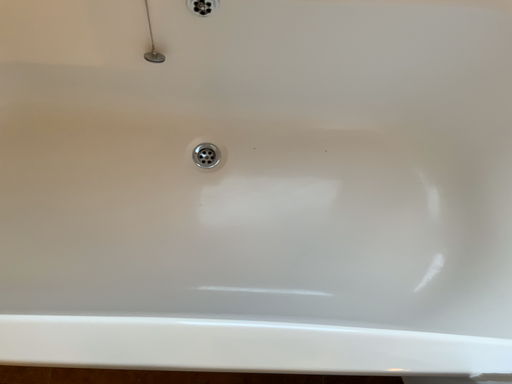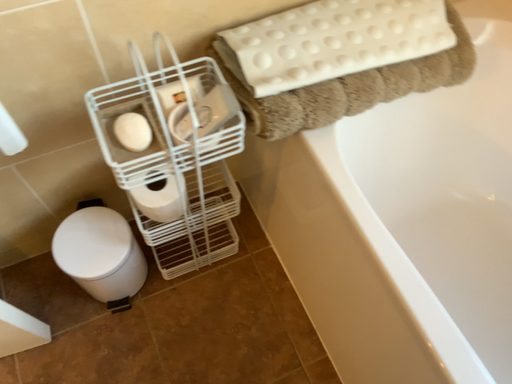
Question: How did the camera likely rotate when shooting the video?

Choices:
 (A) rotated downward
 (B) rotated upward

Answer: (B)